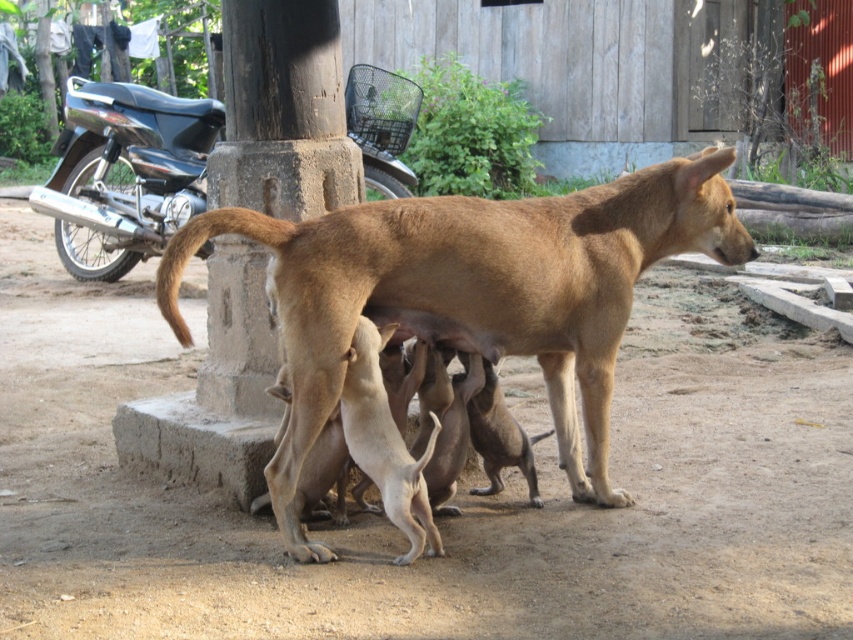
Is point (372, 246) closer to camera compared to point (122, 120)?

Yes, point (372, 246) is closer to viewer.

In order to click on brown smooth dog at center in this screenshot , I will do `click(473, 292)`.

Is brown smooth dog at center positioned behind brown concrete pillar at center?

No.

Is brown smooth dog at center smaller than brown concrete pillar at center?

No.

The width and height of the screenshot is (853, 640). Describe the element at coordinates (473, 292) in the screenshot. I see `brown smooth dog at center` at that location.

Find the location of a particular element. The image size is (853, 640). brown smooth dog at center is located at coordinates (473, 292).

Between brown concrete pillar at center and black glossy motorcycle at upper left, which one appears on the right side from the viewer's perspective?

brown concrete pillar at center is more to the right.

Based on the photo, does brown concrete pillar at center have a larger size compared to black glossy motorcycle at upper left?

Actually, brown concrete pillar at center might be smaller than black glossy motorcycle at upper left.

Who is more distant from viewer, (265, 106) or (393, 152)?

Positioned behind is point (393, 152).

Locate an element on the screen. The width and height of the screenshot is (853, 640). brown concrete pillar at center is located at coordinates (283, 112).